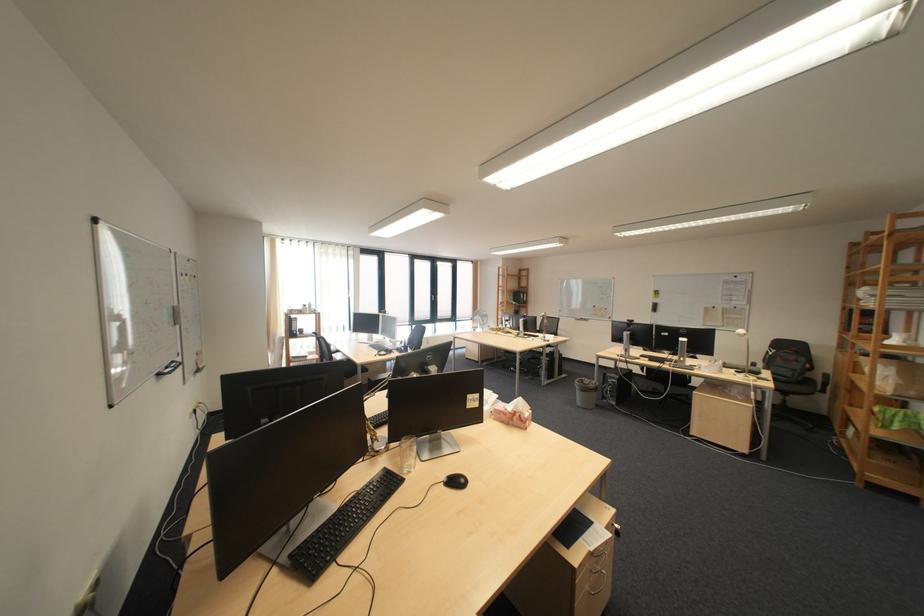
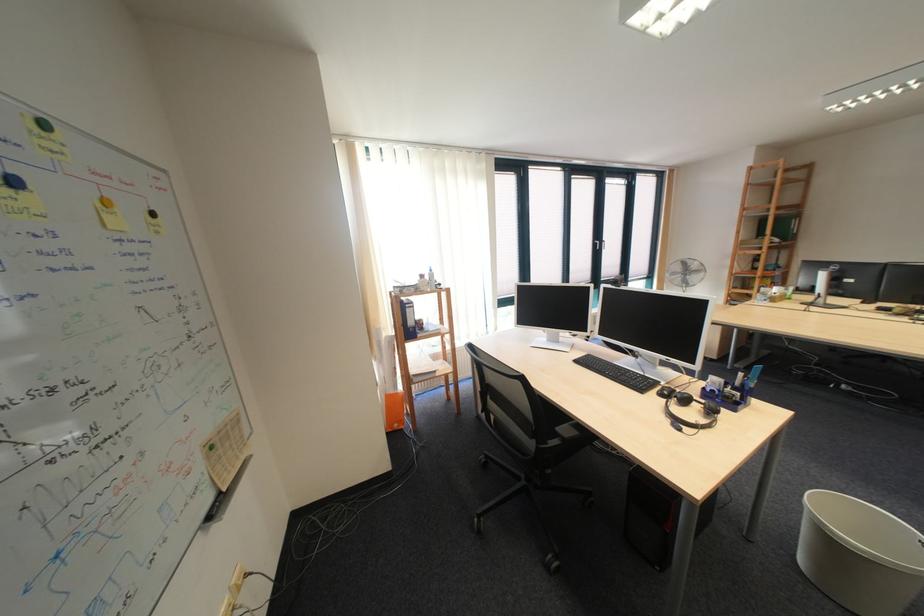
In a continuous first-person perspective shot, in which direction is the camera moving?

The cameraman walked toward left, forward.